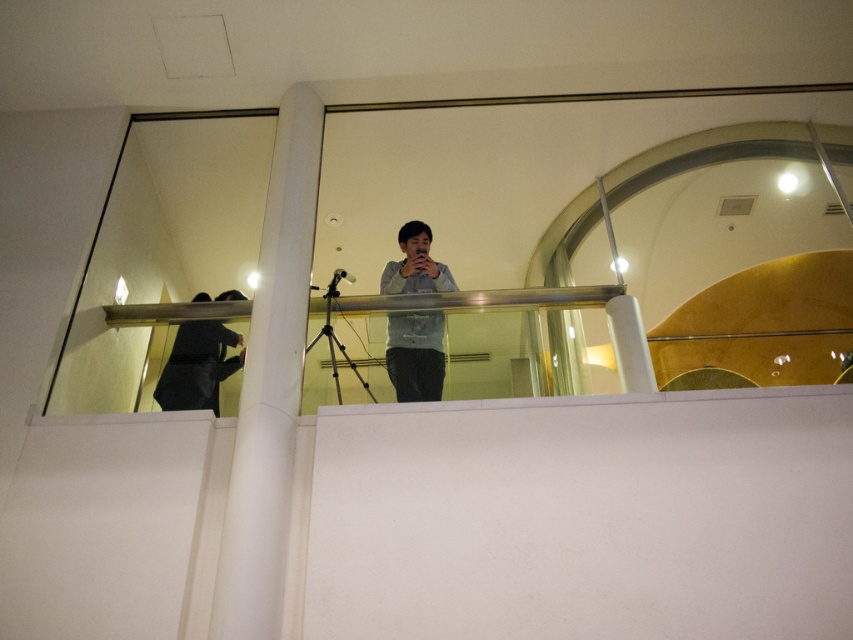
You are trying to hang a decorative banner between the white smooth pillar at center and the dark gray fabric at upper center. Which object is narrower so the banner can be secured properly?

The white smooth pillar at center is thinner than the dark gray fabric at upper center, so the banner can be secured properly around it.

You are standing at the lower level and want to take a photo of the light blue shirt at center without the white smooth pillar at center blocking the view. Is the pillar currently in the way?

The white smooth pillar at center is positioned on the left side of light blue shirt at center, so it is blocking part of the view. Move to the right to position the pillar to the side of the shirt.